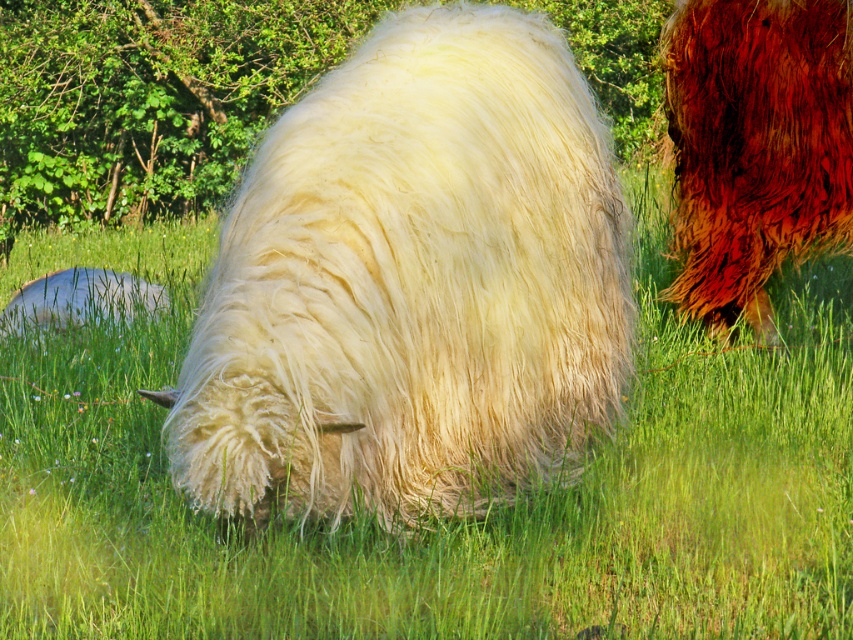
Between shiny reddish-brown fur at upper right and white woolly sheep at lower left, which one is positioned lower?

white woolly sheep at lower left

Identify the location of shiny reddish-brown fur at upper right. The image size is (853, 640). (756, 147).

Does point (722, 54) lie behind point (109, 310)?

No, it is in front of (109, 310).

Locate an element on the screen. The height and width of the screenshot is (640, 853). shiny reddish-brown fur at upper right is located at coordinates (756, 147).

Is white fluffy sheep at center in front of white woolly sheep at lower left?

Yes.

The height and width of the screenshot is (640, 853). What do you see at coordinates (410, 284) in the screenshot?
I see `white fluffy sheep at center` at bounding box center [410, 284].

Locate an element on the screen. Image resolution: width=853 pixels, height=640 pixels. white fluffy sheep at center is located at coordinates (410, 284).

Is white woolly sheep at center positioned at the back of white fluffy sheep at center?

Yes, it is behind white fluffy sheep at center.

Can you confirm if white woolly sheep at center is positioned to the left of white fluffy sheep at center?

Indeed, white woolly sheep at center is positioned on the left side of white fluffy sheep at center.

I want to click on white woolly sheep at center, so click(x=445, y=520).